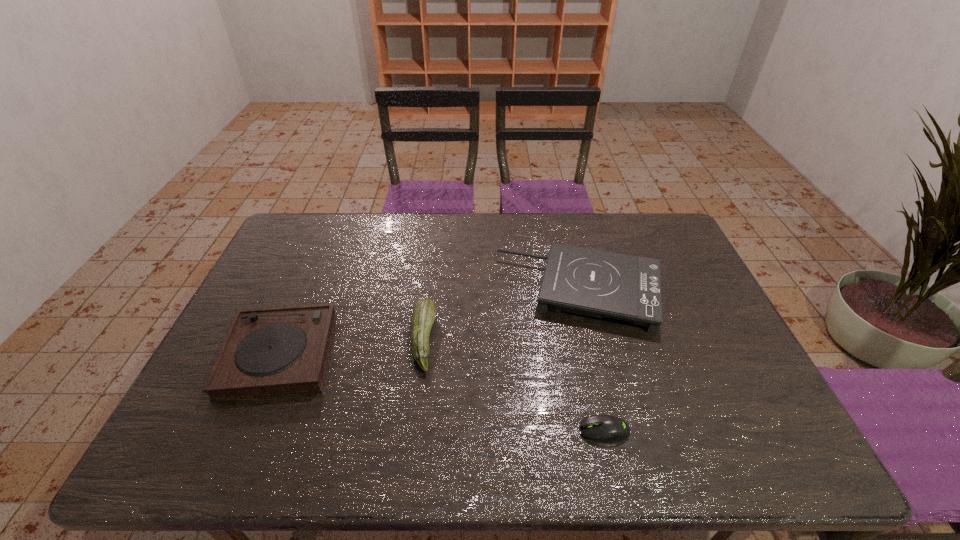
The width and height of the screenshot is (960, 540). I want to click on free spot located 0.060m on the wheel side of the nearest object, so click(553, 430).

Where is `object that is at the near edge`? object that is at the near edge is located at coordinates (602, 428).

Locate an element on the screen. Image resolution: width=960 pixels, height=540 pixels. object located in the left edge section of the desktop is located at coordinates (270, 351).

Where is `object at the right edge`? object at the right edge is located at coordinates (590, 282).

The image size is (960, 540). In order to click on free region at the far edge of the desktop in this screenshot , I will do (463, 249).

Locate an element on the screen. vacant area at the near edge of the desktop is located at coordinates (416, 457).

In the image, there is a desktop. Where is `vacant space at the left edge`? Image resolution: width=960 pixels, height=540 pixels. vacant space at the left edge is located at coordinates (189, 416).

Identify the location of vacant space at the right edge of the desktop. This screenshot has width=960, height=540. (717, 393).

Locate an element on the screen. blank space at the near left corner of the desktop is located at coordinates (171, 448).

In the image, there is a desktop. Where is `free space at the far right corner`? free space at the far right corner is located at coordinates (654, 216).